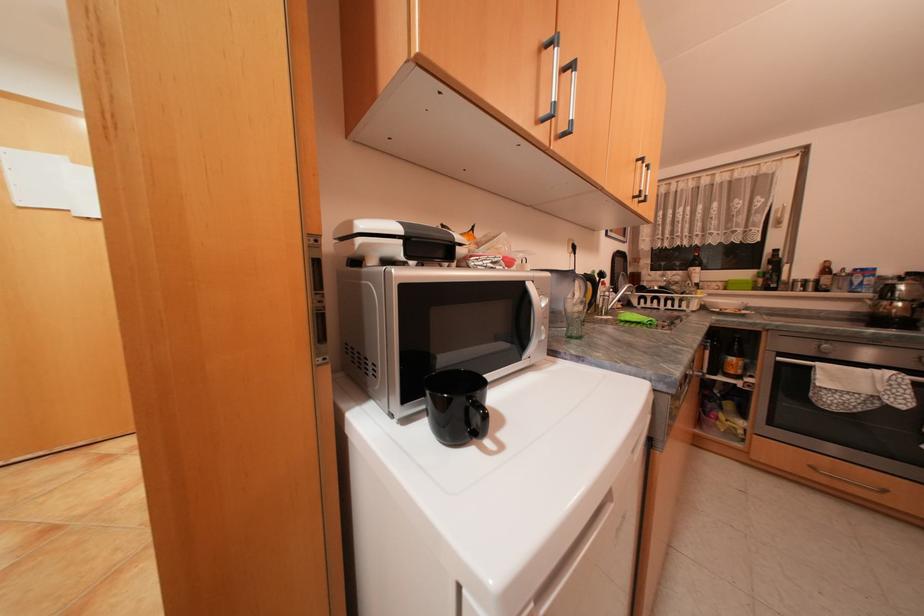
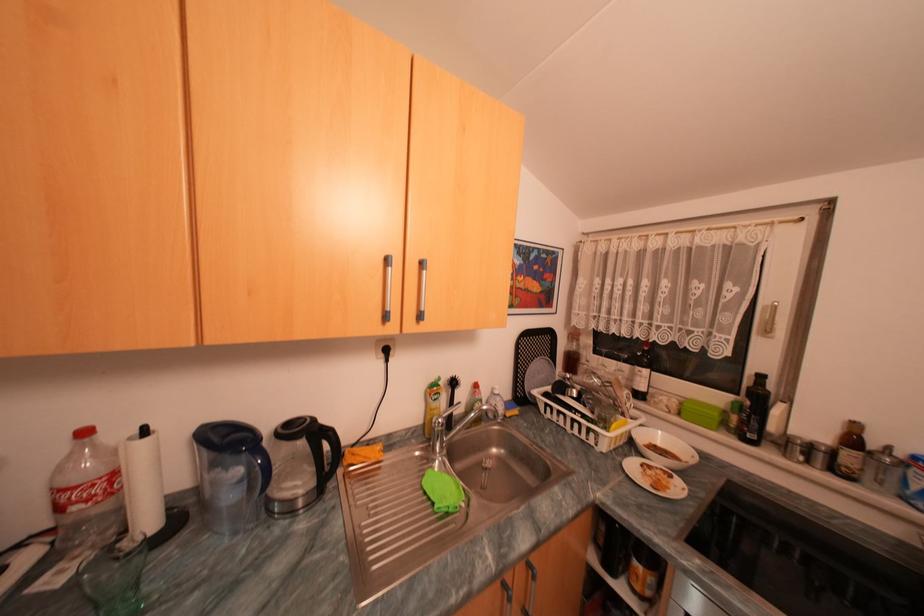
In the second image, find the point that corresponds to pixel 835 270 in the first image.

(862, 440)